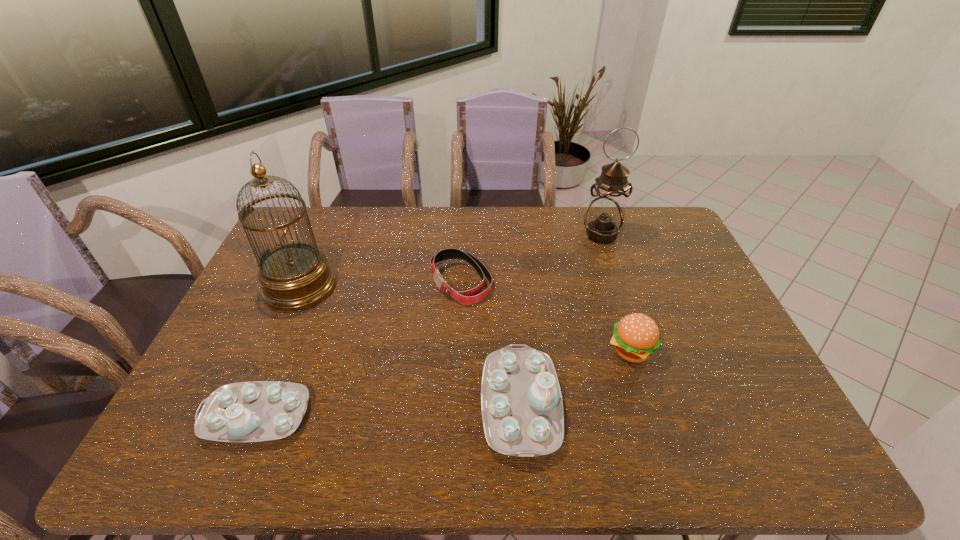
Locate an element on the screen. The image size is (960, 540). the third closest object to the hamburger is located at coordinates (603, 219).

This screenshot has height=540, width=960. I want to click on object that is the closest to the hamburger, so click(522, 411).

Locate an element on the screen. free region that satisfies the following two spatial constraints: 1. with an open door on the birdcage; 2. on the right side of the left chinaware is located at coordinates tap(244, 416).

Locate an element on the screen. free location that satisfies the following two spatial constraints: 1. on the back side of the shorter chinaware; 2. with an open door on the birdcage is located at coordinates (310, 287).

Where is `vacant area that satisfies the following two spatial constraints: 1. on the back side of the oil lamp; 2. on the left side of the shortest object`? vacant area that satisfies the following two spatial constraints: 1. on the back side of the oil lamp; 2. on the left side of the shortest object is located at coordinates (463, 235).

At what (x,y) coordinates should I click in order to perform the action: click on vacant space that satisfies the following two spatial constraints: 1. with an open door on the birdcage; 2. on the right side of the right chinaware. Please return your answer as a coordinate pair (x, y). This screenshot has width=960, height=540. Looking at the image, I should click on (249, 404).

The width and height of the screenshot is (960, 540). Identify the location of vacant position in the image that satisfies the following two spatial constraints: 1. on the back side of the hamburger; 2. with an open door on the birdcage. (611, 287).